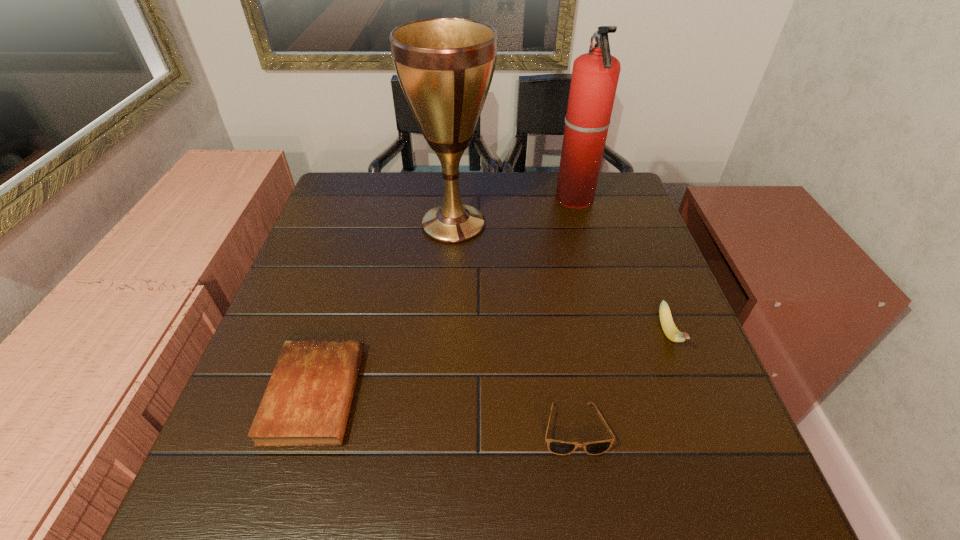
The image size is (960, 540). Find the location of `free region located 0.270m at the stem of the banana`. free region located 0.270m at the stem of the banana is located at coordinates (732, 495).

What are the coordinates of `free spot located 0.100m on the frames of the sunglasses` in the screenshot? It's located at (588, 517).

In order to click on vacant space located on the spine side of the leftmost object in this screenshot , I will do `click(392, 394)`.

Locate an element on the screen. trophy cup located at the far edge is located at coordinates (445, 66).

Where is `fire extinguisher at the far edge`? The image size is (960, 540). fire extinguisher at the far edge is located at coordinates (595, 75).

Find the location of a particular element. The width and height of the screenshot is (960, 540). object that is at the left edge is located at coordinates (307, 401).

You are a GUI agent. You are given a task and a screenshot of the screen. Output one action in this format:
    pyautogui.click(x=<x>, y=<y>)
    Task: Click on the fire extinguisher that is at the right edge
    Image resolution: width=960 pixels, height=540 pixels.
    Given the screenshot: What is the action you would take?
    pyautogui.click(x=595, y=75)

This screenshot has width=960, height=540. Identify the location of banana that is at the right edge. (667, 323).

The height and width of the screenshot is (540, 960). Find the location of `object at the far right corner`. object at the far right corner is located at coordinates (595, 75).

Image resolution: width=960 pixels, height=540 pixels. In the image, there is a desktop. What are the coordinates of `vacant space at the far edge` in the screenshot? It's located at (475, 203).